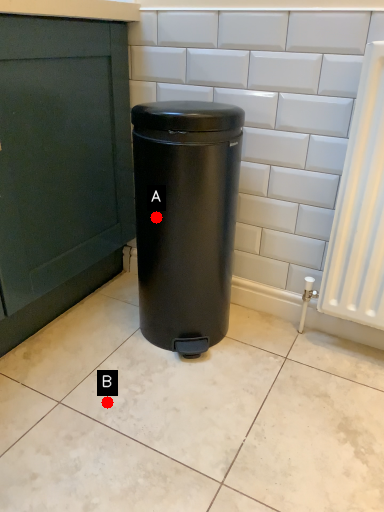
Question: Two points are circled on the image, labeled by A and B beside each circle. Which point is closer to the camera?

Choices:
 (A) A is closer
 (B) B is closer

Answer: (B)